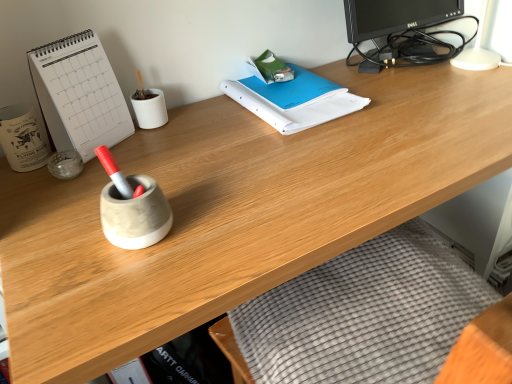
Locate an element on the screen. This screenshot has width=512, height=384. free space in front of white ceramic mug at left, which appears as the second stationery when viewed from the right is located at coordinates (35, 206).